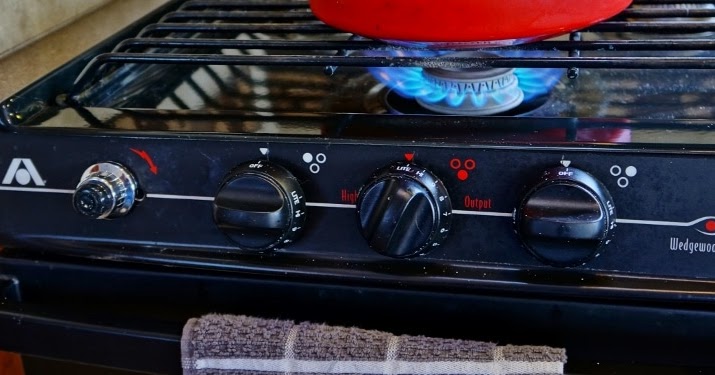
The image size is (715, 375). What are the coordinates of `beige countertop and wall background` in the screenshot? It's located at (56, 44), (36, 15).